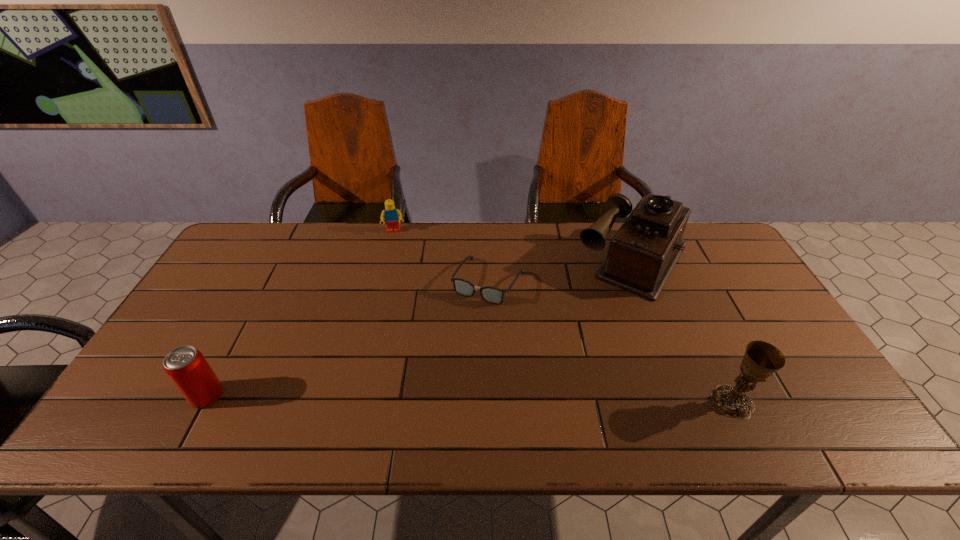
At what (x,y) coordinates should I click in order to perform the action: click on free spot on the desktop that is between the third shortest object and the chalice and is positioned on the face of the spectacles. Please return your answer as a coordinate pair (x, y). Looking at the image, I should click on (421, 398).

You are a GUI agent. You are given a task and a screenshot of the screen. Output one action in this format:
    pyautogui.click(x=<x>, y=<y>)
    Task: Click on the free spot on the desktop that is between the leftmost object and the chalice and is positioned on the horn of the phonograph_record
    This screenshot has height=540, width=960.
    Given the screenshot: What is the action you would take?
    pyautogui.click(x=540, y=400)

You are a GUI agent. You are given a task and a screenshot of the screen. Output one action in this format:
    pyautogui.click(x=<x>, y=<y>)
    Task: Click on the vacant space on the desktop that is between the leftmost object and the chalice and is positioned on the front-facing side of the second object from left to right
    This screenshot has height=540, width=960.
    Given the screenshot: What is the action you would take?
    pyautogui.click(x=395, y=397)